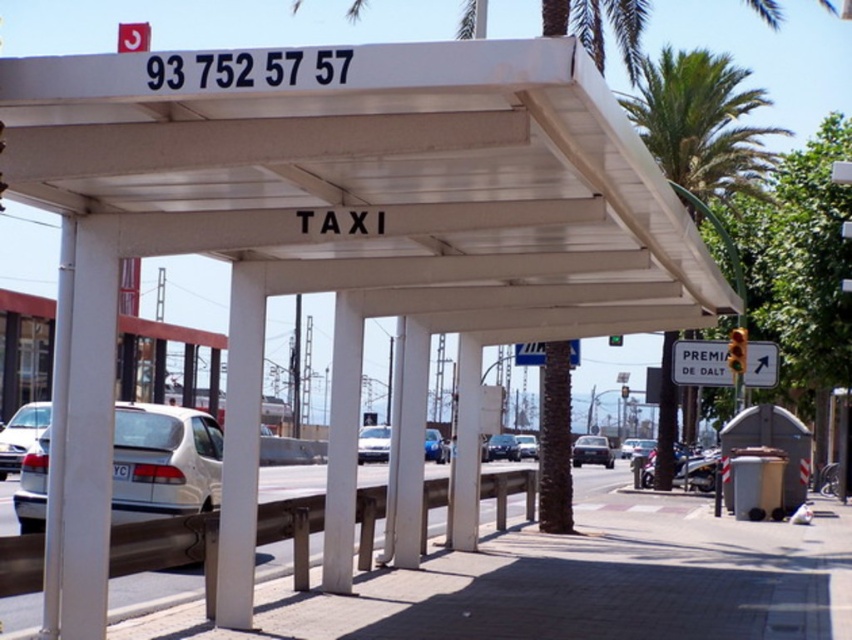
Question: Does white concrete pavement at center come in front of matte silver sedan at left?

Choices:
 (A) no
 (B) yes

Answer: (B)

Question: Is white plastic sign at upper right wider than metallic silver sedan at center?

Choices:
 (A) no
 (B) yes

Answer: (A)

Question: Which object is closer to the camera taking this photo?

Choices:
 (A) silver metallic sedan at center
 (B) metallic silver sedan at center

Answer: (B)

Question: Is white concrete pavement at center above metallic silver sedan at center?

Choices:
 (A) yes
 (B) no

Answer: (B)

Question: Among these points, which one is farthest from the camera?

Choices:
 (A) (522, 444)
 (B) (707, 360)
 (C) (705, 580)

Answer: (A)

Question: Which point appears closest to the camera in this image?

Choices:
 (A) (676, 342)
 (B) (538, 346)

Answer: (B)